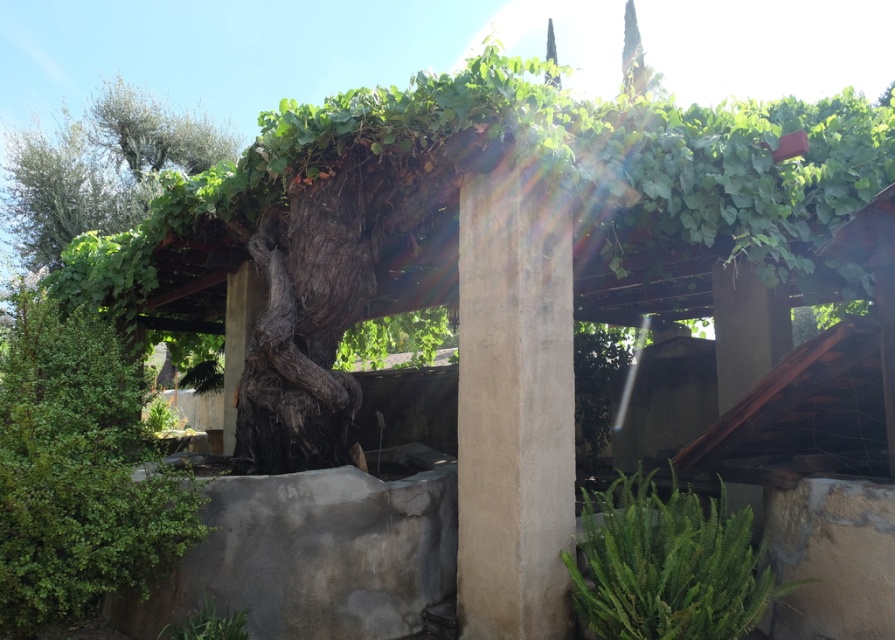
Looking at this image, you are designing a garden layout and need to place a small bench between the smooth concrete pillar at center and the green leafy plant at lower right. Which object should the bench be closer to if you want it to be proportionally balanced with their sizes?

The bench should be closer to the green leafy plant at lower right because the smooth concrete pillar at center is bigger than the green leafy plant at lower right, so placing the bench closer to the smaller object helps achieve a balanced layout.

You are standing in the garden and see the point marked at coordinates (x=514, y=403). What object is located at that point?

The point at coordinates (x=514, y=403) corresponds to the smooth concrete pillar at center.

You are standing in the garden and want to water the green leafy plant at lower right. The watering can is placed at point (x=666, y=563). Is the watering can near the plant?

Yes, the watering can is placed at point (x=666, y=563), which marks the location of the green leafy plant at lower right, so the watering can is near the plant.